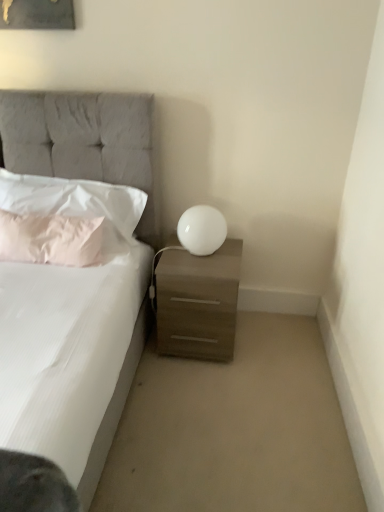
Find the location of a particular element. This screenshot has width=384, height=512. empty space that is ontop of matte wood nightstand at lower right (from a real-world perspective) is located at coordinates (202, 261).